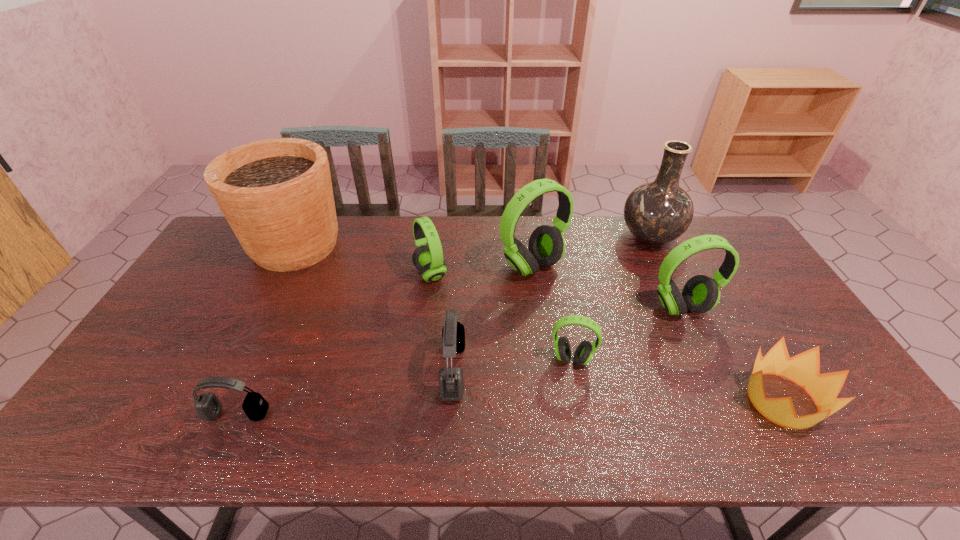
The width and height of the screenshot is (960, 540). I want to click on vase, so click(x=657, y=212).

Locate an element on the screen. flowerpot is located at coordinates (276, 194).

Where is `the biggest green headset`? This screenshot has width=960, height=540. the biggest green headset is located at coordinates (546, 247).

You are a GUI agent. You are given a task and a screenshot of the screen. Output one action in this format:
    pyautogui.click(x=<x>, y=<y>)
    Task: Click on the rightmost headset
    The image size is (960, 540).
    Given the screenshot: What is the action you would take?
    pyautogui.click(x=700, y=294)

The image size is (960, 540). What are the coordinates of `the third farthest headset` in the screenshot? It's located at (700, 294).

Locate an element on the screen. Image resolution: width=960 pixels, height=540 pixels. the third biggest green headset is located at coordinates (428, 259).

Where is `the leftmost green headset`? the leftmost green headset is located at coordinates (428, 259).

I want to click on the farther black headset, so click(x=451, y=385).

This screenshot has width=960, height=540. Identify the location of the bigger black headset. (451, 385).

What are the coordinates of `the nearest green headset` in the screenshot? It's located at (585, 350).